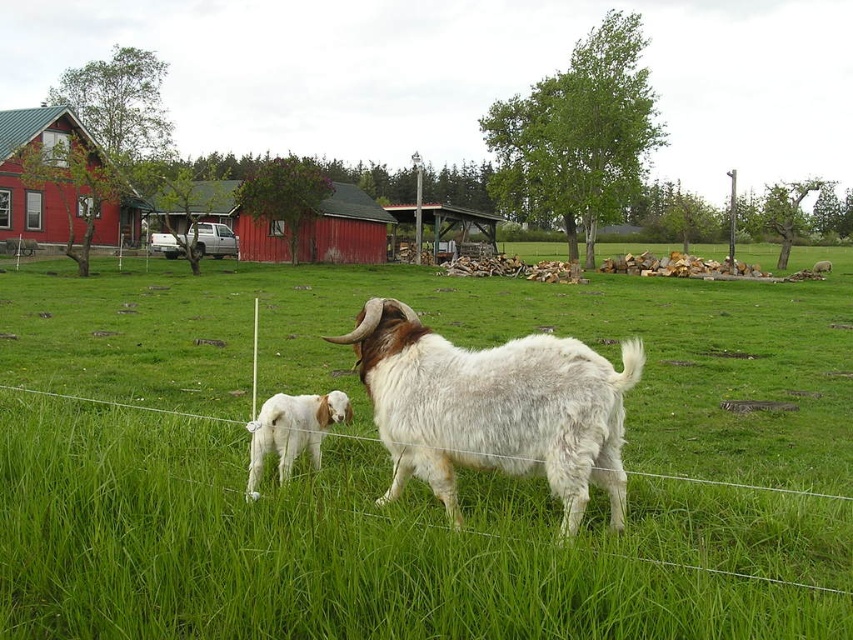
Question: Which object is the farthest from the white woolen goat at lower left?

Choices:
 (A) red wooden barn at left
 (B) green grassy field at center

Answer: (A)

Question: Among these points, which one is farthest from the camera?

Choices:
 (A) (120, 228)
 (B) (312, 477)

Answer: (A)

Question: Where is white woolen goat at center located in relation to white woolen goat at lower left in the image?

Choices:
 (A) right
 (B) left

Answer: (A)

Question: Does white woolen goat at center appear under white woolen goat at lower left?

Choices:
 (A) yes
 (B) no

Answer: (B)

Question: Which of the following is the farthest from the observer?

Choices:
 (A) (397, 403)
 (B) (83, 428)
 (C) (45, 116)

Answer: (C)

Question: Can you confirm if green grassy field at center is bigger than white woolen goat at lower left?

Choices:
 (A) yes
 (B) no

Answer: (A)